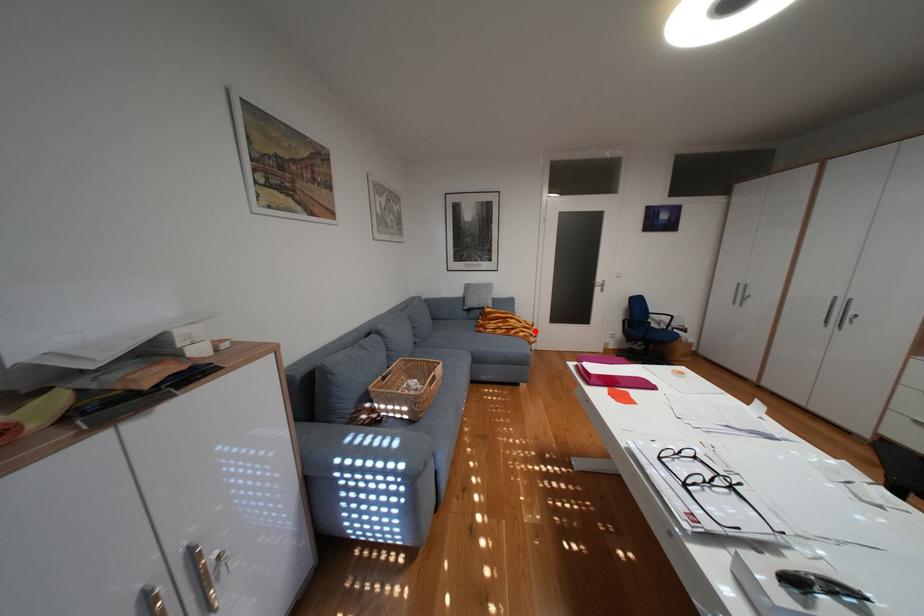
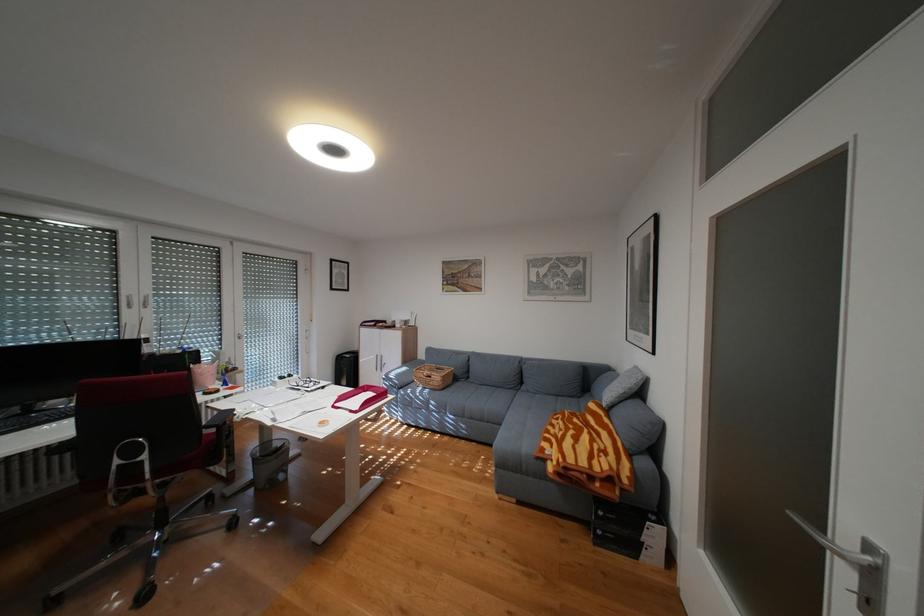
Find the pixel in the second image that matches the highlighted location in the first image.

(564, 445)